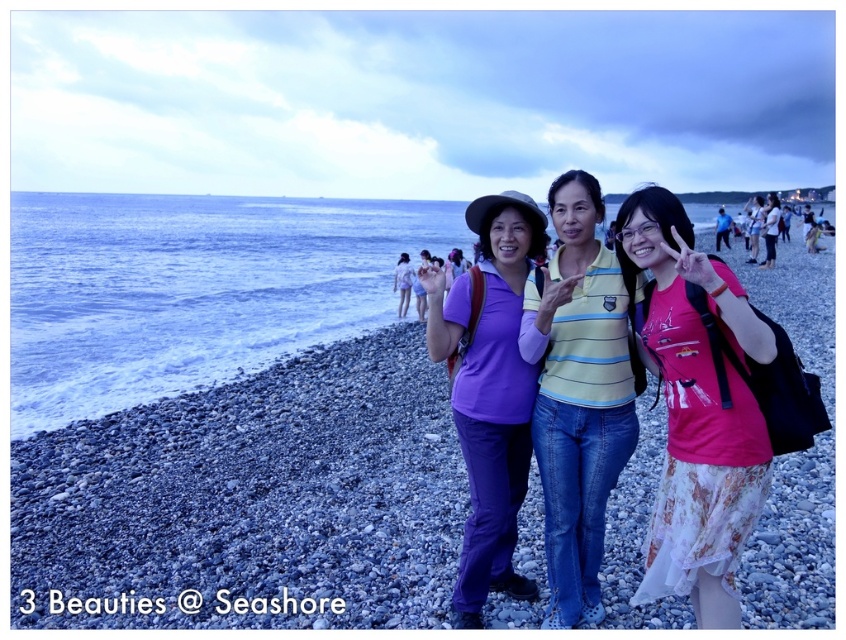
You are a photographer trying to capture a photo of the pebble beach at center and the pink lace skirt at center. If your camera has a focal length of 50mm and you want to ensure both subjects are in focus, what should you consider about their distance apart?

The distance between the pebble beach at center and the pink lace skirt at center is 5.96 meters. To ensure both are in focus, you should use a smaller aperture to increase depth of field, as the subjects are relatively far apart.

You are a photographer trying to capture a wide shot of the entire scene. Since you have limited space on your memory card, you want to ensure that the pebble beach at center and the pink lace skirt at center are both visible but prioritize keeping the larger object in focus. Which object should you focus on to ensure it remains sharp in the photo?

The pebble beach at center is larger in size than the pink lace skirt at center, so you should focus on the pebble beach at center to ensure it remains sharp in the photo.